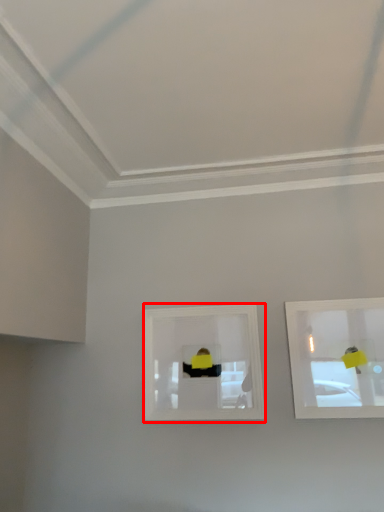
Question: Observing the image, what is the correct spatial positioning of picture frame (annotated by the red box) in reference to picture frame?

Choices:
 (A) right
 (B) left

Answer: (B)